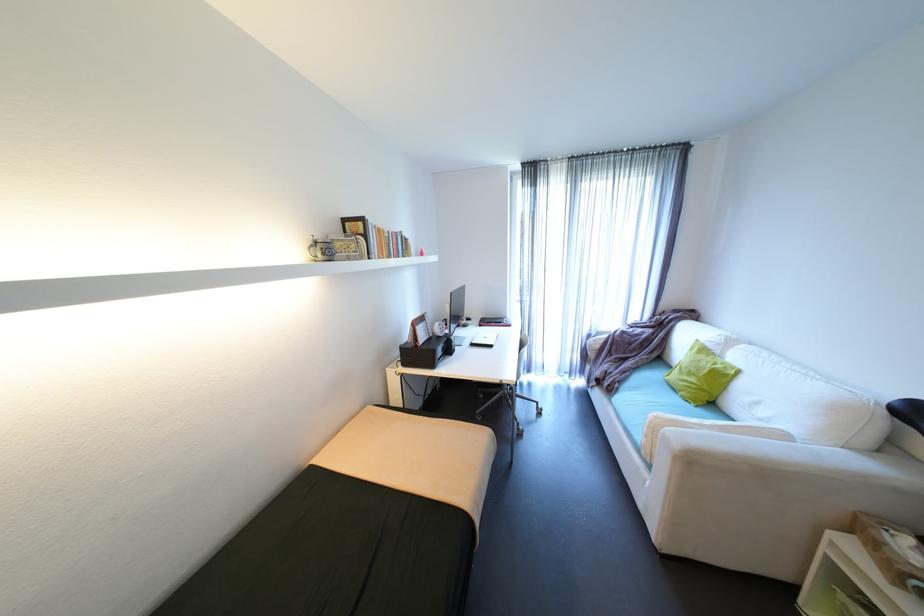
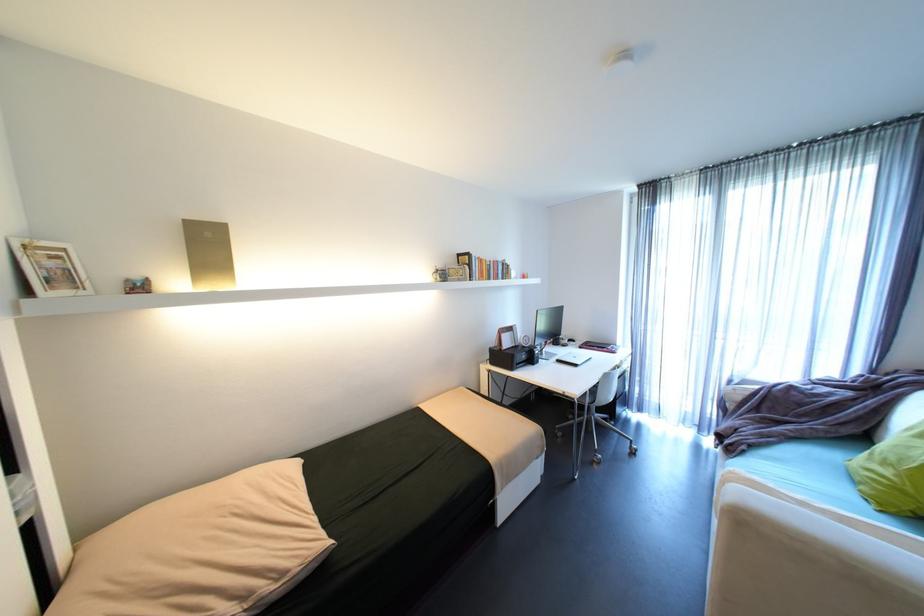
Where in the second image is the point corresponding to pixel 488 322 from the first image?

(589, 344)